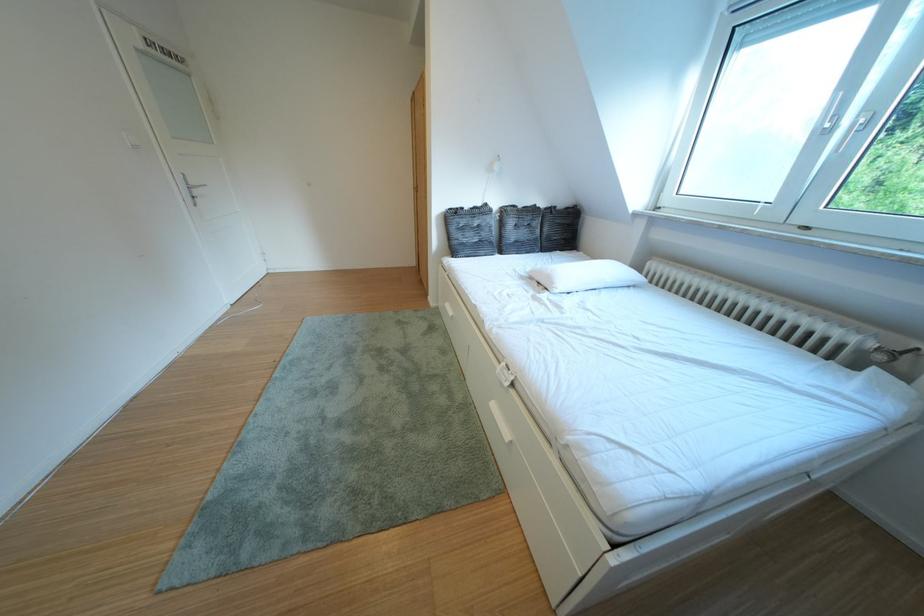
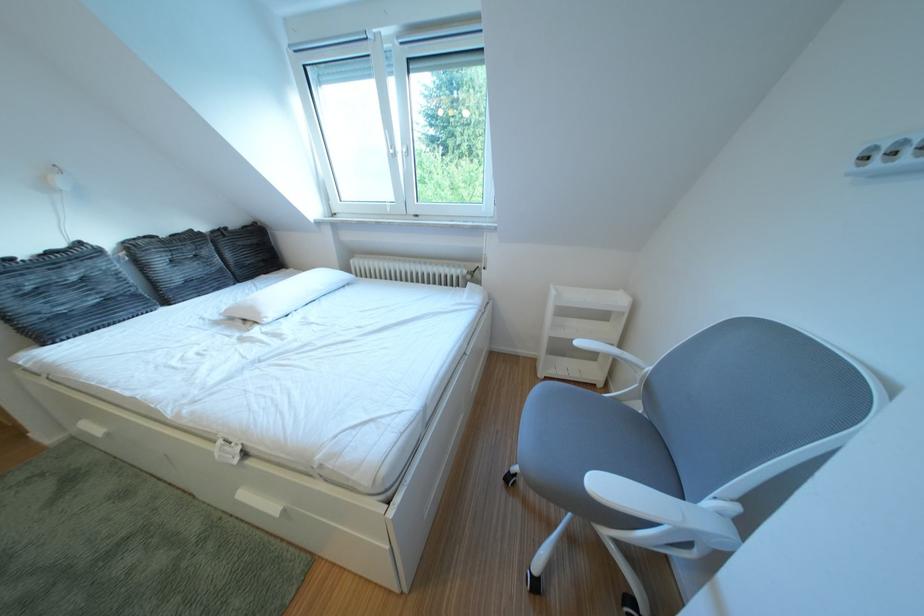
Question: I am providing you with two images of the same scene from different viewpoints. Please identify which objects are invisible in image2.

Choices:
 (A) white drawer handle
 (B) radiator knob
 (C) dark tufted pillow
 (D) none of these

Answer: (D)